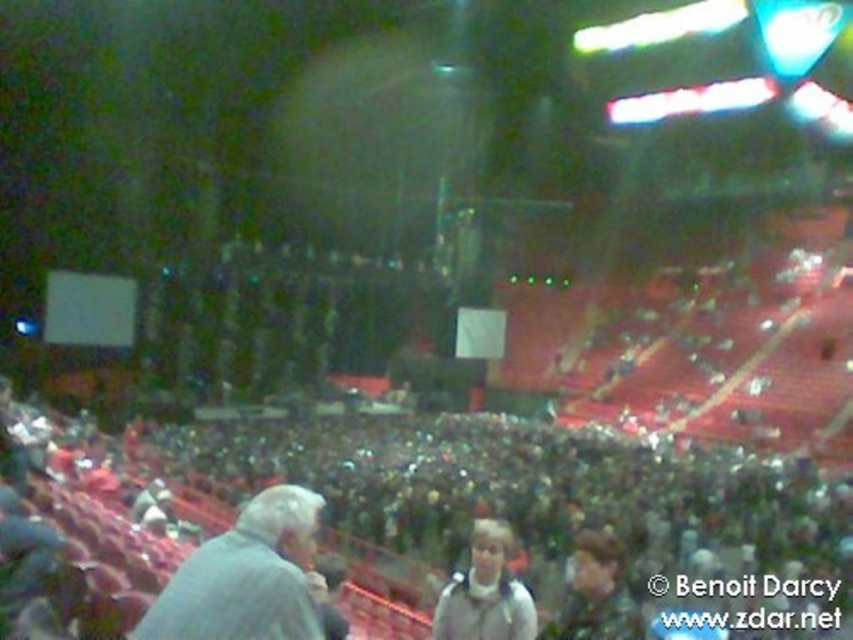
Is point (271, 506) positioned in front of point (599, 547)?

Yes, it is in front of point (599, 547).

Does gray wool sweater at lower left have a larger size compared to light gray hoodie at center?

Yes.

Does point (314, 600) come closer to viewer compared to point (590, 636)?

That is True.

Identify the location of gray wool sweater at lower left. (245, 577).

Is point (477, 621) in front of point (575, 598)?

Yes, point (477, 621) is in front of point (575, 598).

Consider the image. Does white fleece jacket at center have a greater height compared to light gray hoodie at center?

No, white fleece jacket at center is not taller than light gray hoodie at center.

This screenshot has width=853, height=640. Identify the location of white fleece jacket at center. (485, 593).

Looking at this image, is gray wool sweater at lower left closer to camera compared to white fleece jacket at center?

Yes, it is.

Can you confirm if gray wool sweater at lower left is wider than white fleece jacket at center?

Yes.

Is point (277, 484) positioned behind point (490, 625)?

Yes, point (277, 484) is farther from viewer.

Where is `gray wool sweater at lower left`? The height and width of the screenshot is (640, 853). gray wool sweater at lower left is located at coordinates (245, 577).